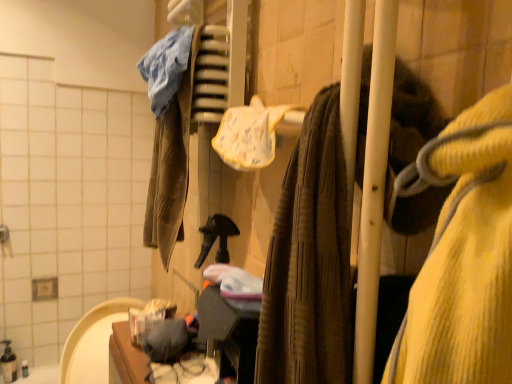
Question: In the image, is white textured cloth at center positioned in front of or behind knitted wool sweater at center?

Choices:
 (A) behind
 (B) front

Answer: (A)

Question: In terms of size, does white textured cloth at center appear bigger or smaller than knitted wool sweater at center?

Choices:
 (A) small
 (B) big

Answer: (A)

Question: From a real-world perspective, relative to knitted wool sweater at center, is white textured cloth at center vertically above or below?

Choices:
 (A) above
 (B) below

Answer: (A)

Question: From a real-world perspective, is knitted wool sweater at center above or below white textured cloth at center?

Choices:
 (A) above
 (B) below

Answer: (B)

Question: Based on their positions, is knitted wool sweater at center located to the left or right of white textured cloth at center?

Choices:
 (A) right
 (B) left

Answer: (A)

Question: From the image's perspective, is knitted wool sweater at center located above or below white textured cloth at center?

Choices:
 (A) below
 (B) above

Answer: (A)

Question: Looking at their shapes, would you say knitted wool sweater at center is wider or thinner than white textured cloth at center?

Choices:
 (A) thin
 (B) wide

Answer: (B)